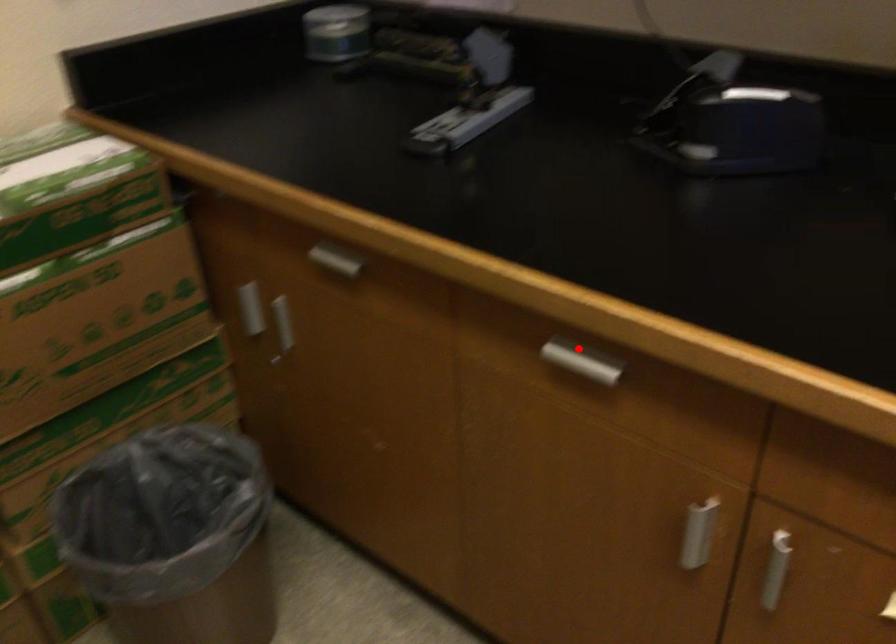
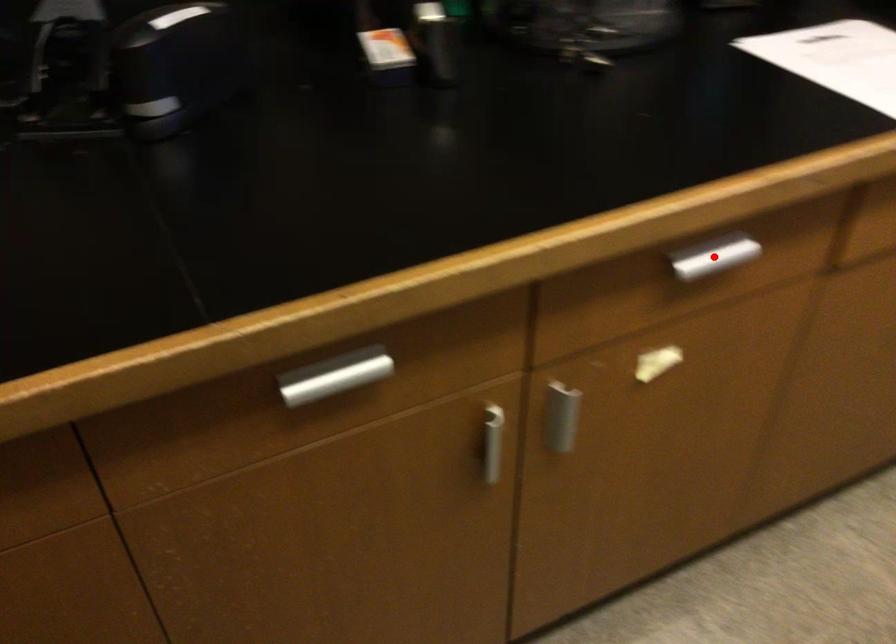
I am providing you with two images of the same scene from different viewpoints. A red point is marked on the first image and another point is marked on the second image. Is the marked point in image1 the same physical position as the marked point in image2?

No